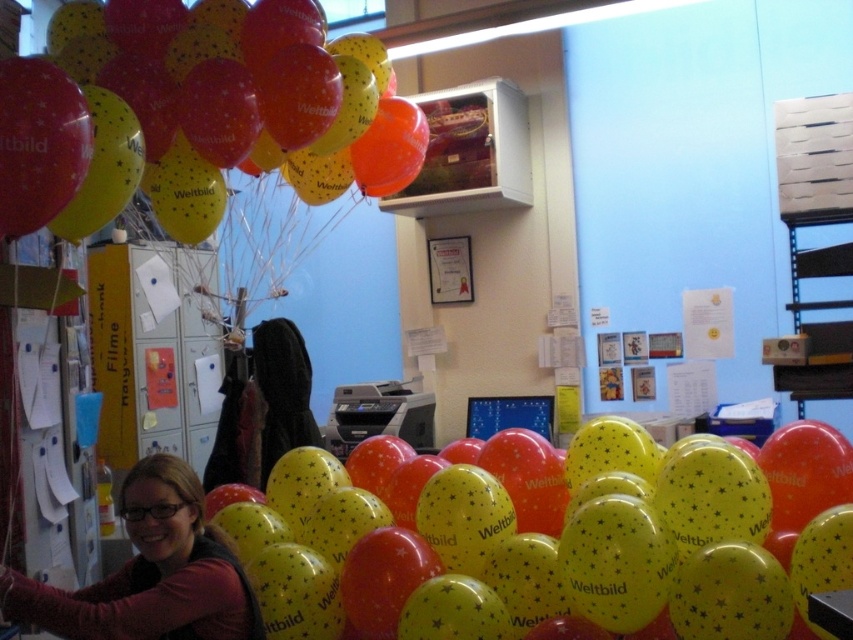
You are organizing a party and need to decide which item to place first in the setup. Based on their sizes, which object should you handle first, the matte yellow balloon at upper left or the matte black sweater at lower left?

The matte yellow balloon at upper left is bigger than the matte black sweater at lower left, so you should handle the matte yellow balloon at upper left first due to its larger size.

You are organizing a party and need to arrange the balloons. If you want to place the yellow glossy balloon at center to the left of the matte yellow balloon at upper left, is that possible based on their current positions?

The yellow glossy balloon at center is currently positioned on the right side of the matte yellow balloon at upper left, so moving it to the left would require adjusting their positions since they are already arranged with the glossy one on the right.

You are standing in the festive office scene looking at the balloons. There are two points marked in the image. Which point is closer to you, point (706, 486) or point (299, 67)?

Point (706, 486) is closer to you because it is further to the viewer than point (299, 67).